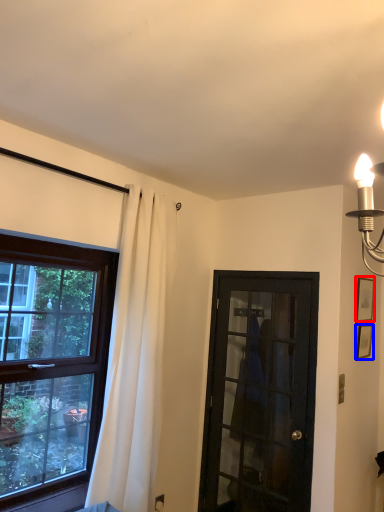
Question: Which point is further to the camera, picture frame (highlighted by a red box) or picture frame (highlighted by a blue box)?

Choices:
 (A) picture frame
 (B) picture frame

Answer: (A)